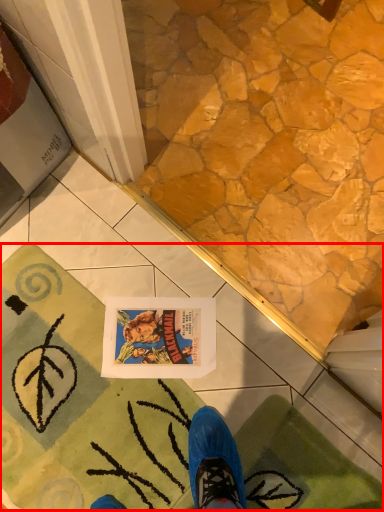
Question: In this image, where is bath mat (annotated by the red box) located relative to bath mat?

Choices:
 (A) right
 (B) left

Answer: (B)